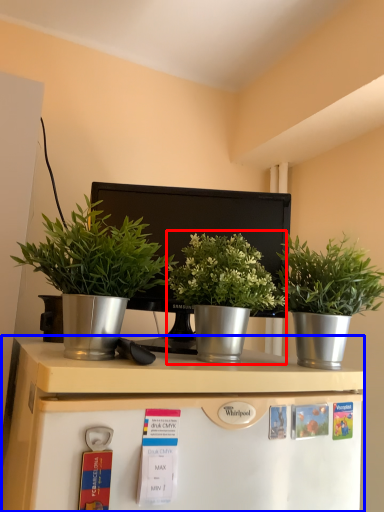
Question: Which object is closer to the camera taking this photo, houseplant (highlighted by a red box) or table (highlighted by a blue box)?

Choices:
 (A) houseplant
 (B) table

Answer: (B)